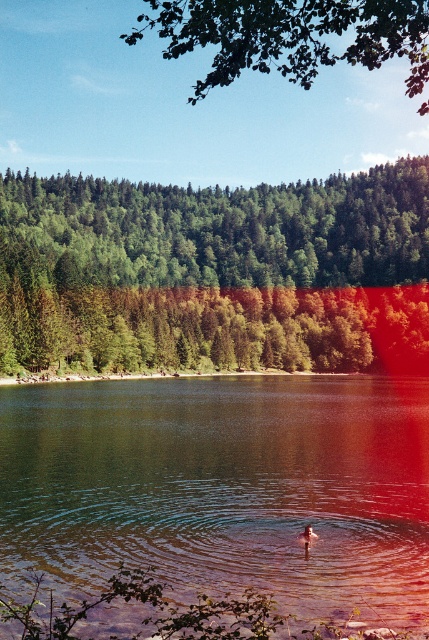
You are standing at the point marked as point (x=223, y=488) in the image. Based on the scene description, what would you observe around you?

You would observe clear water at center around you since the point (x=223, y=488) corresponds to clear water at center.

Based on the scene description, where exactly is the clear water at center located in the image?

The clear water at center is located at point coordinates of (223, 488).

You are standing at the center of the lakeside scene. There is a green matte tree at center. Which direction should you walk to avoid the area affected by the red filter overlay on the right side?

The green matte tree at center is located at point (215,273). Since the red filter overlay affects the right side, you should walk to the left to avoid the red filtered area.